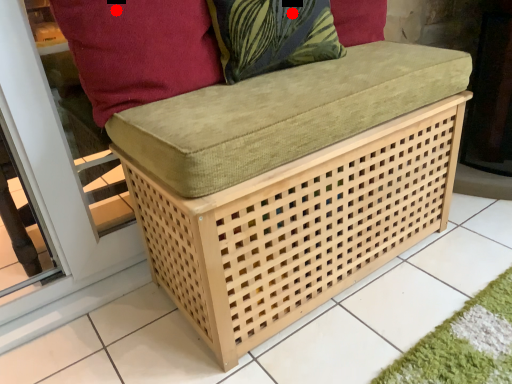
Question: Two points are circled on the image, labeled by A and B beside each circle. Which point is further to the camera?

Choices:
 (A) A is further
 (B) B is further

Answer: (B)